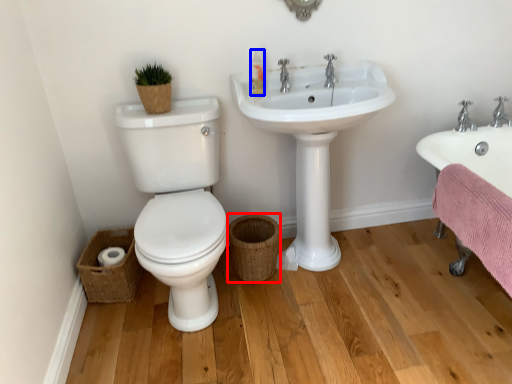
Question: Which point is further to the camera, basket (highlighted by a red box) or toiletry (highlighted by a blue box)?

Choices:
 (A) basket
 (B) toiletry

Answer: (A)